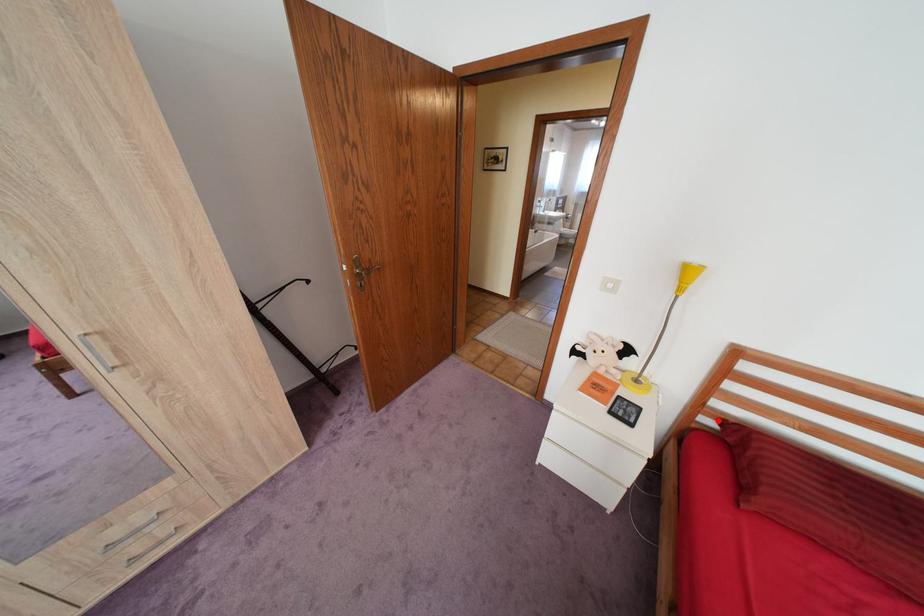
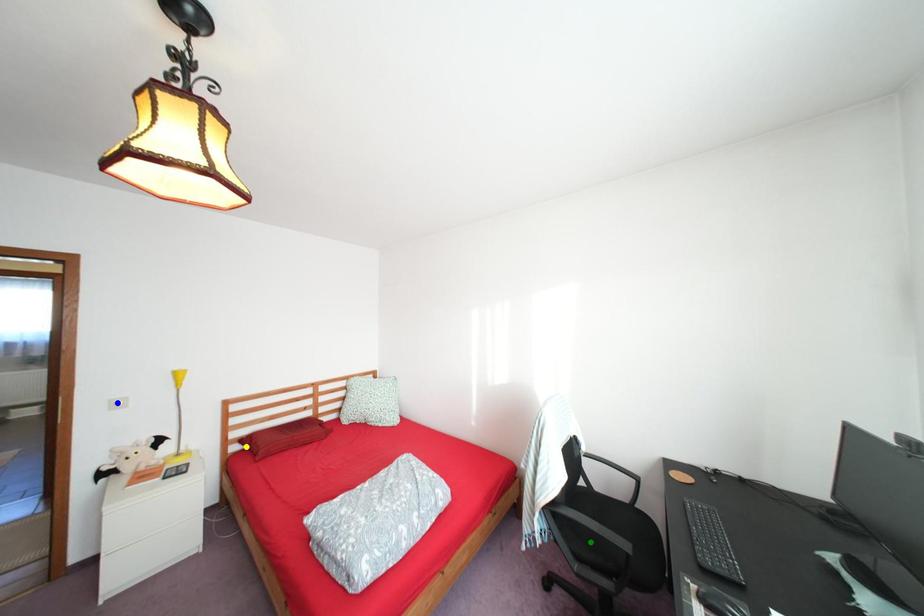
Question: I am providing you with two images of the same scene from different viewpoints. A red point is marked on the first image. You are given multiple points on the second image. Which mark in image 2 goes with the point in image 1?

Choices:
 (A) green point
 (B) yellow point
 (C) blue point

Answer: (B)